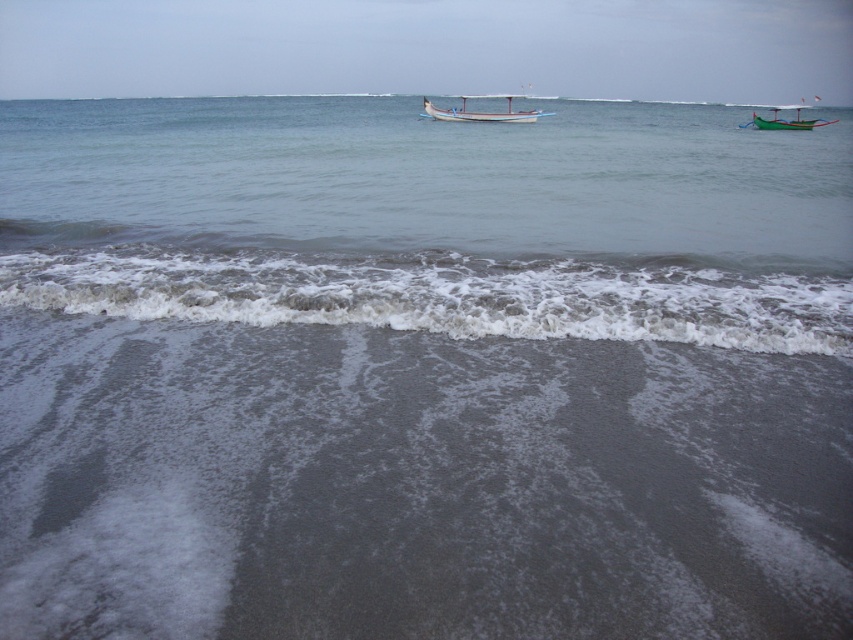
Looking at this image, you are a photographer planning to take a photo of the gray matte sand at lower center and the green wooden boat at upper right. Which object should you focus on first if you want to capture both in sharp focus?

The gray matte sand at lower center is shorter than the green wooden boat at upper right, so you should focus on the green wooden boat at upper right first to ensure both are in sharp focus.

You are standing on the beach and looking out at the ocean. You see the white wooden boat at center and the green wooden boat at upper right. Which boat is closer to the horizon?

The green wooden boat at upper right is closer to the horizon because the white wooden boat at center is located above it, meaning the green wooden boat is further away in the background.

You are standing at the edge of the beach looking out at the ocean. There is a gray matte sand at lower center marked by point (440, 294). If you walk straight towards the ocean from your current position, will you step on the gray matte sand at lower center before reaching the water?

Yes, the gray matte sand at lower center is located at point (440, 294), which is between your current position at the edge of the beach and the water. Therefore, walking straight towards the ocean, you will step on the gray matte sand at lower center before reaching the water.